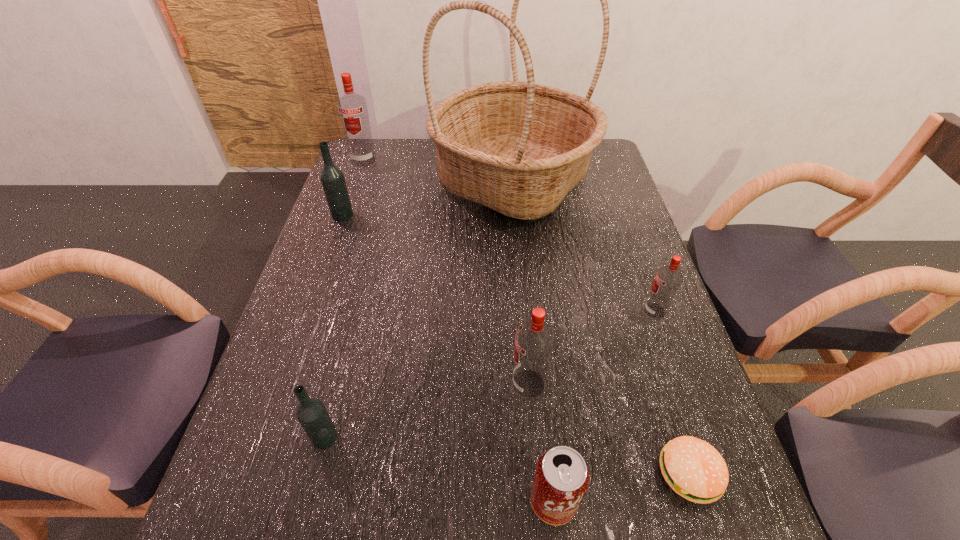
Locate an element on the screen. This screenshot has width=960, height=540. blank space located on the front label of the second vodka from right to left is located at coordinates (426, 384).

Image resolution: width=960 pixels, height=540 pixels. In order to click on vacant region located 0.240m on the front label of the rightmost red vodka in this screenshot , I will do `click(545, 311)`.

I want to click on blank space located 0.400m on the front label of the rightmost red vodka, so click(x=480, y=311).

Locate an element on the screen. The height and width of the screenshot is (540, 960). vacant area located on the front label of the rightmost red vodka is located at coordinates (611, 311).

Where is `vacant space located on the right of the right black vodka`? The height and width of the screenshot is (540, 960). vacant space located on the right of the right black vodka is located at coordinates (399, 437).

Where is `vacant space situated 0.140m on the right of the red soda can`? The width and height of the screenshot is (960, 540). vacant space situated 0.140m on the right of the red soda can is located at coordinates (656, 501).

At what (x,y) coordinates should I click in order to perform the action: click on free space located on the left of the patty. Please return your answer as a coordinate pair (x, y). This screenshot has width=960, height=540. Looking at the image, I should click on (598, 474).

At what (x,y) coordinates should I click in order to perform the action: click on basket that is positioned at the far edge. Please return your answer as a coordinate pair (x, y). This screenshot has height=540, width=960. Looking at the image, I should click on click(519, 148).

Identify the location of vodka that is at the far edge. (352, 108).

Where is `object that is at the near edge`? This screenshot has height=540, width=960. object that is at the near edge is located at coordinates (561, 479).